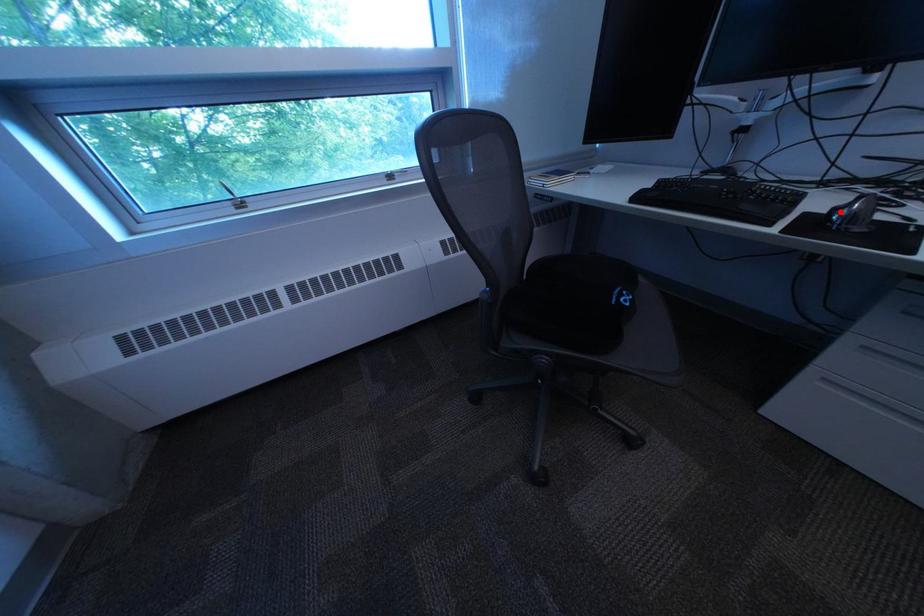
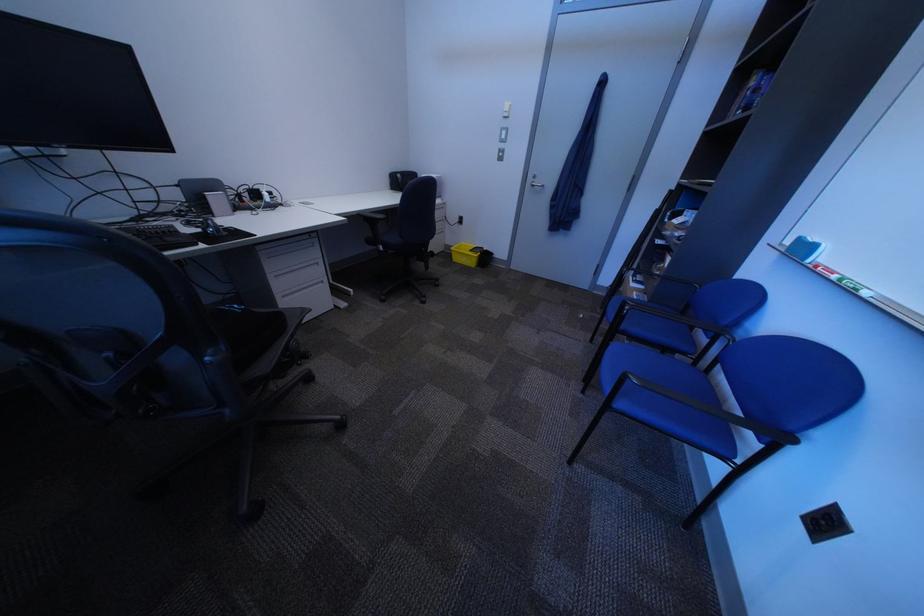
In the second image, find the point that corresponds to the highlighted location in the first image.

(214, 232)